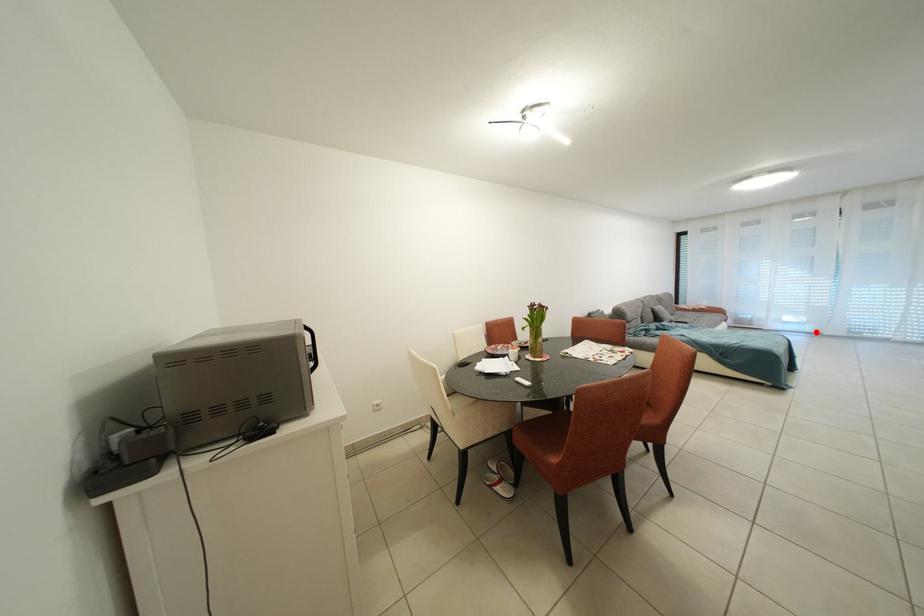
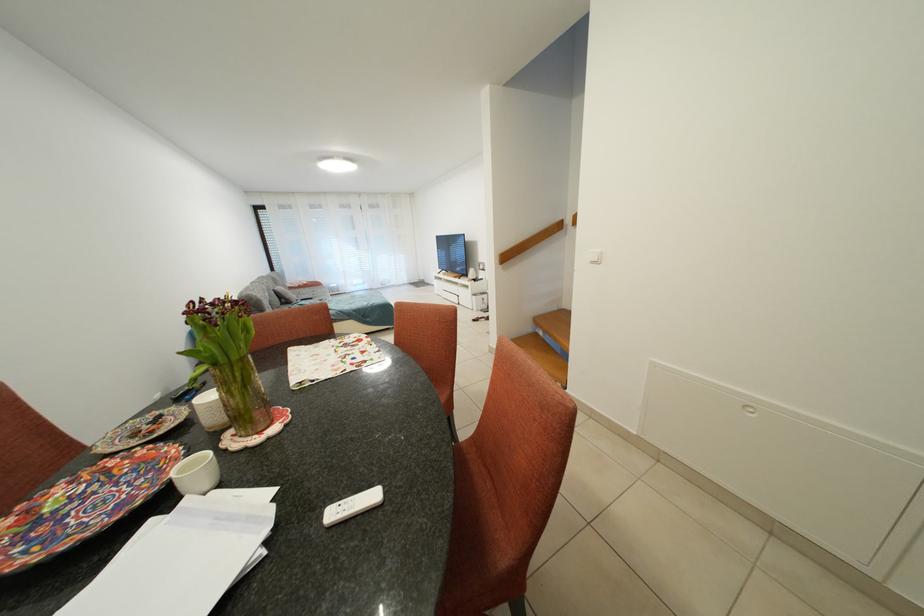
Locate, in the second image, the point that corresponds to the highlighted location in the first image.

(373, 291)